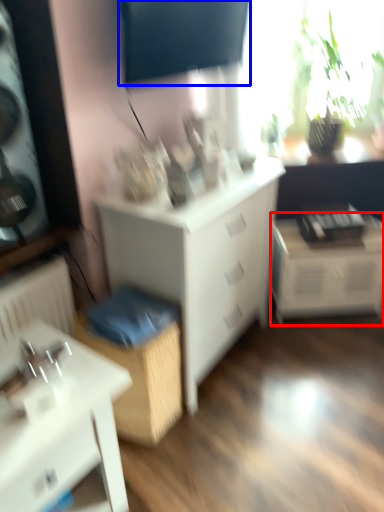
Question: Which object is closer to the camera taking this photo, table (highlighted by a red box) or window screen (highlighted by a blue box)?

Choices:
 (A) table
 (B) window screen

Answer: (B)